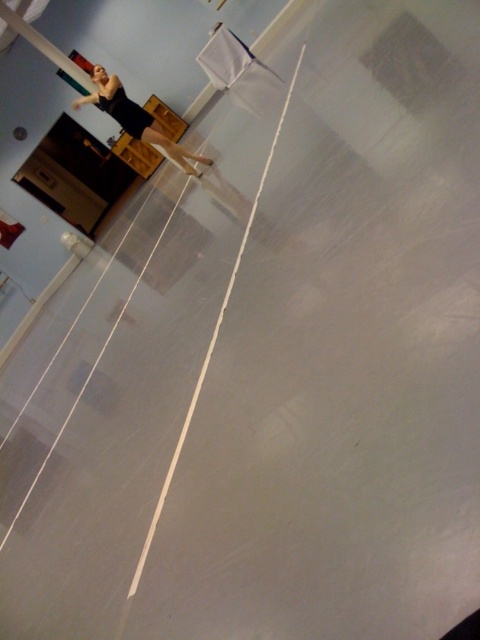
You are a dancer wearing a black matte dress at upper left and need to grab a metallic pole at upper left during a routine. Can you reach the pole without moving your feet?

The black matte dress at upper left is 1.72 meters away from the metallic pole at upper left. Since the distance is greater than an average person can reach without moving, you cannot reach the pole without moving your feet.

In the scene shown: You are a dancer in the studio. You see a point marked at coordinates (135, 118). Where exactly is this point located?

The point marked at coordinates (135, 118) is located on the black matte dress at upper left.